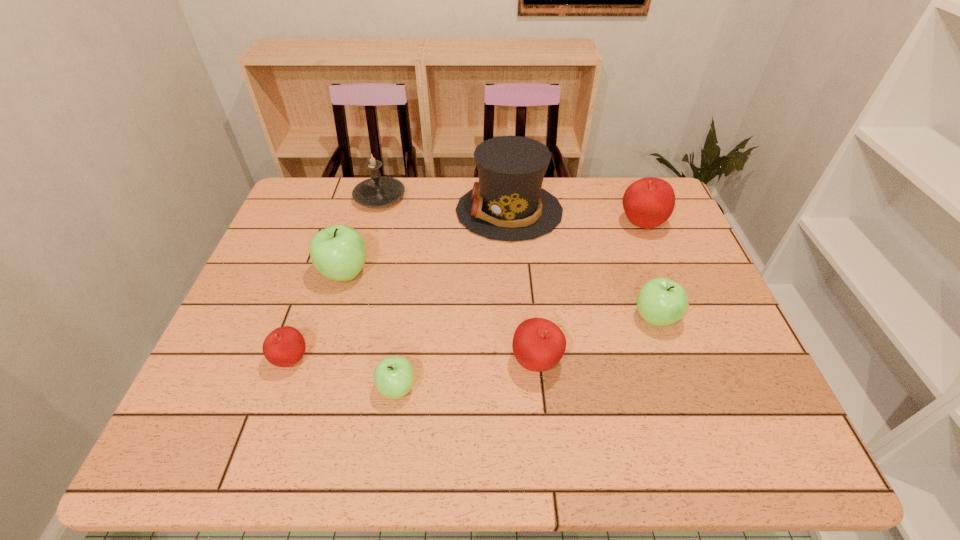
The width and height of the screenshot is (960, 540). In order to click on vacant space in between the third apple from left to right and the smallest red apple in this screenshot , I will do `click(345, 374)`.

The height and width of the screenshot is (540, 960). I want to click on blank region between the third apple from right to left and the third farthest apple, so click(596, 340).

Where is `vacant region between the leftmost green apple and the second smallest green apple`? The width and height of the screenshot is (960, 540). vacant region between the leftmost green apple and the second smallest green apple is located at coordinates (500, 295).

Select which object appears as the seventh closest to the smallest red apple. Please provide its 2D coordinates. Your answer should be formatted as a tuple, i.e. [(x, y)], where the tuple contains the x and y coordinates of a point satisfying the conditions above.

[(648, 202)]

Choose which object is the nearest neighbor to the candle. Please provide its 2D coordinates. Your answer should be formatted as a tuple, i.e. [(x, y)], where the tuple contains the x and y coordinates of a point satisfying the conditions above.

[(507, 203)]

Identify which apple is the second nearest to the rightmost green apple. Please provide its 2D coordinates. Your answer should be formatted as a tuple, i.e. [(x, y)], where the tuple contains the x and y coordinates of a point satisfying the conditions above.

[(648, 202)]

Where is `apple that can be found as the third closest to the smallest green apple`? This screenshot has height=540, width=960. apple that can be found as the third closest to the smallest green apple is located at coordinates (339, 252).

Locate an element on the screen. the closest red apple relative to the fifth nearest apple is located at coordinates (285, 346).

The width and height of the screenshot is (960, 540). I want to click on red apple object that ranks as the third closest to the tallest object, so click(x=285, y=346).

The image size is (960, 540). What are the coordinates of `green apple that stands as the third closest to the rightmost red apple` in the screenshot? It's located at (339, 252).